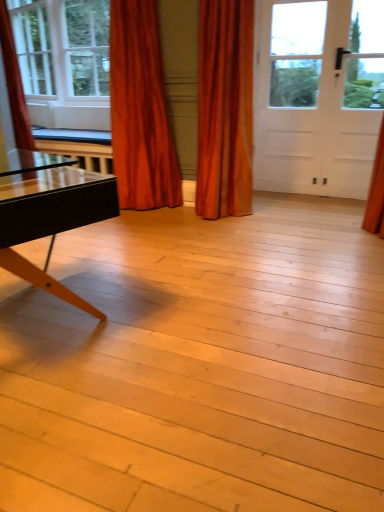
Question: From a real-world perspective, relative to velvet orange curtain at left, which appears as the third curtain when viewed from the right, is white matte door at upper right vertically above or below?

Choices:
 (A) above
 (B) below

Answer: (B)

Question: Relative to velvet orange curtain at left, which appears as the first curtain when viewed from the left, is white matte door at upper right in front or behind?

Choices:
 (A) behind
 (B) front

Answer: (A)

Question: Which object is the farthest from the white matte door at upper right?

Choices:
 (A) velvet orange curtain at left, which appears as the third curtain when viewed from the right
 (B) velvet orange curtain at center, which is the first curtain from right to left
 (C) clear glass window at upper left
 (D) satin orange curtain at upper left, positioned as the second curtain in right-to-left order

Answer: (A)

Question: Which object is positioned farthest from the velvet orange curtain at center, which is the third curtain from left to right?

Choices:
 (A) velvet orange curtain at left, which appears as the third curtain when viewed from the right
 (B) clear glass window at upper left
 (C) white matte door at upper right
 (D) satin orange curtain at upper left, positioned as the second curtain in right-to-left order

Answer: (B)